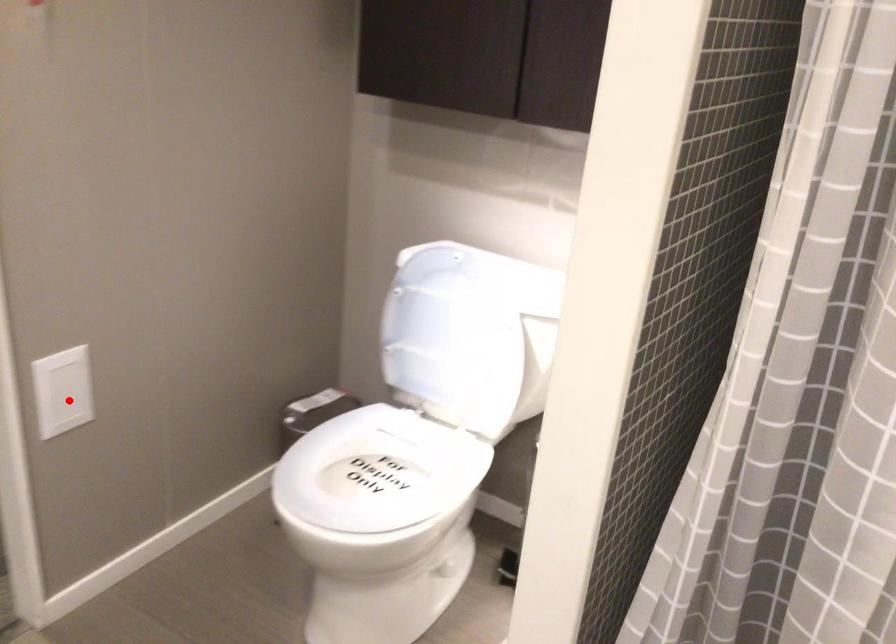
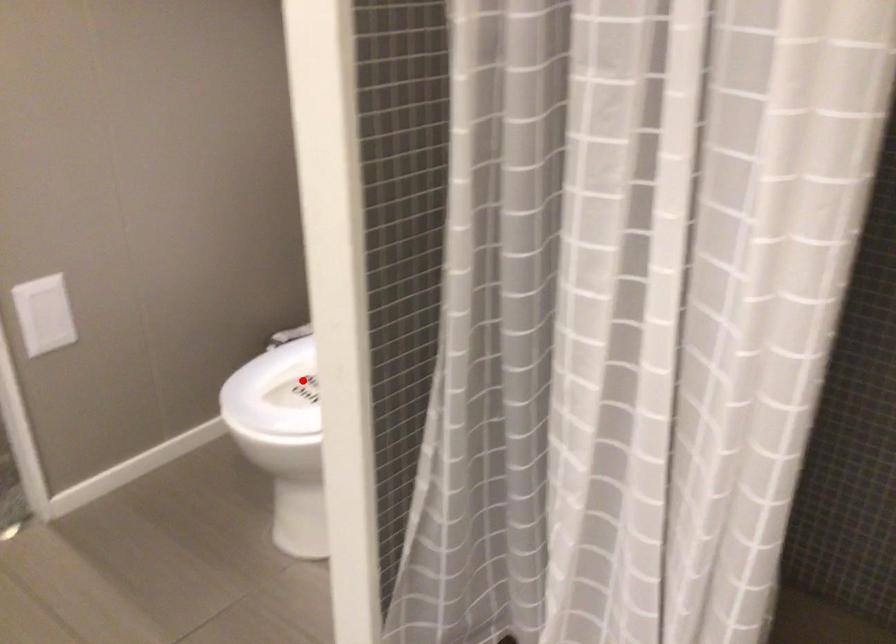
I am providing you with two images of the same scene from different viewpoints. A red point is marked on the first image and another point is marked on the second image. Are the points marked in image1 and image2 representing the same 3D position?

No